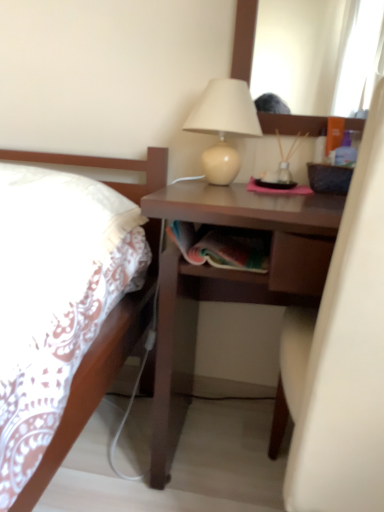
This screenshot has width=384, height=512. Find the location of `brown matte desk at center`. brown matte desk at center is located at coordinates (233, 275).

Describe the element at coordinates (233, 275) in the screenshot. I see `brown matte desk at center` at that location.

Locate an element on the screen. Image resolution: width=384 pixels, height=512 pixels. matte beige lamp at upper center is located at coordinates (223, 126).

Image resolution: width=384 pixels, height=512 pixels. What do you see at coordinates (223, 126) in the screenshot?
I see `matte beige lamp at upper center` at bounding box center [223, 126].

You are a GUI agent. You are given a task and a screenshot of the screen. Output one action in this format:
    pyautogui.click(x=<x>, y=<y>)
    Task: Click on the brown matte desk at center
    
    Given the screenshot: What is the action you would take?
    pyautogui.click(x=233, y=275)

Considering the positions of objects matte beige lamp at upper center and brown matte desk at center in the image provided, who is more to the right, matte beige lamp at upper center or brown matte desk at center?

brown matte desk at center.

Which object is further away from the camera taking this photo, matte beige lamp at upper center or brown matte desk at center?

matte beige lamp at upper center is further away from the camera.

Which is behind, point (223, 165) or point (221, 291)?

Point (221, 291)

From the image's perspective, is matte beige lamp at upper center positioned above or below brown matte desk at center?

From the image's perspective, matte beige lamp at upper center appears above brown matte desk at center.

From a real-world perspective, between matte beige lamp at upper center and brown matte desk at center, who is vertically lower?

brown matte desk at center, from a real-world perspective.

Considering the sizes of objects matte beige lamp at upper center and brown matte desk at center in the image provided, who is thinner, matte beige lamp at upper center or brown matte desk at center?

matte beige lamp at upper center is thinner.

Looking at this image, between matte beige lamp at upper center and brown matte desk at center, which one has less height?

matte beige lamp at upper center is shorter.

Is matte beige lamp at upper center smaller than brown matte desk at center?

Yes, matte beige lamp at upper center is smaller than brown matte desk at center.

Is matte beige lamp at upper center located outside brown matte desk at center?

Yes.

Would you consider matte beige lamp at upper center to be distant from brown matte desk at center?

No, matte beige lamp at upper center is not far from brown matte desk at center.

Is matte beige lamp at upper center facing towards brown matte desk at center?

No, matte beige lamp at upper center is not turned towards brown matte desk at center.

How many degrees apart are the facing directions of matte beige lamp at upper center and brown matte desk at center?

0.445 degrees separate the facing orientations of matte beige lamp at upper center and brown matte desk at center.

At what (x,y) coordinates should I click in order to perform the action: click on desk in front of the matte beige lamp at upper center. Please return your answer as a coordinate pair (x, y). Looking at the image, I should click on (233, 275).

Which object is positioned more to the left, brown matte desk at center or matte beige lamp at upper center?

matte beige lamp at upper center is more to the left.

In the image, is brown matte desk at center positioned in front of or behind matte beige lamp at upper center?

In the image, brown matte desk at center appears in front of matte beige lamp at upper center.

Is point (228, 215) closer or farther from the camera than point (188, 122)?

Point (228, 215) appears to be closer to the viewer than point (188, 122).

From the image's perspective, would you say brown matte desk at center is positioned over matte beige lamp at upper center?

No.

From a real-world perspective, is brown matte desk at center physically located above or below matte beige lamp at upper center?

From a real-world perspective, brown matte desk at center is physically below matte beige lamp at upper center.

Is brown matte desk at center thinner than matte beige lamp at upper center?

No.

Considering the sizes of brown matte desk at center and matte beige lamp at upper center in the image, is brown matte desk at center taller or shorter than matte beige lamp at upper center?

Clearly, brown matte desk at center is taller compared to matte beige lamp at upper center.

Considering the sizes of objects brown matte desk at center and matte beige lamp at upper center in the image provided, who is bigger, brown matte desk at center or matte beige lamp at upper center?

brown matte desk at center.

Can we say brown matte desk at center lies outside matte beige lamp at upper center?

Yes, brown matte desk at center is outside of matte beige lamp at upper center.

Is brown matte desk at center placed right next to matte beige lamp at upper center?

No, brown matte desk at center is not next to matte beige lamp at upper center.

Is brown matte desk at center aimed at matte beige lamp at upper center?

No, brown matte desk at center is not turned towards matte beige lamp at upper center.

What's the angular difference between brown matte desk at center and matte beige lamp at upper center's facing directions?

The angle between the facing direction of brown matte desk at center and the facing direction of matte beige lamp at upper center is 0.445 degrees.

What are the coordinates of `lamp above the brown matte desk at center (from a real-world perspective)` in the screenshot? It's located at (223, 126).

Identify the location of lamp above the brown matte desk at center (from the image's perspective). (223, 126).

Locate an element on the screen. The height and width of the screenshot is (512, 384). lamp behind the brown matte desk at center is located at coordinates (223, 126).